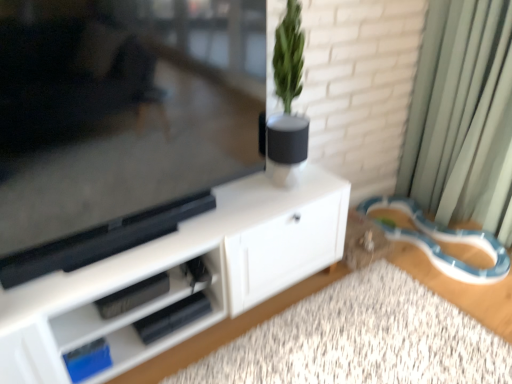
I want to click on vacant area that is in front of white matte vase at center, so click(x=278, y=202).